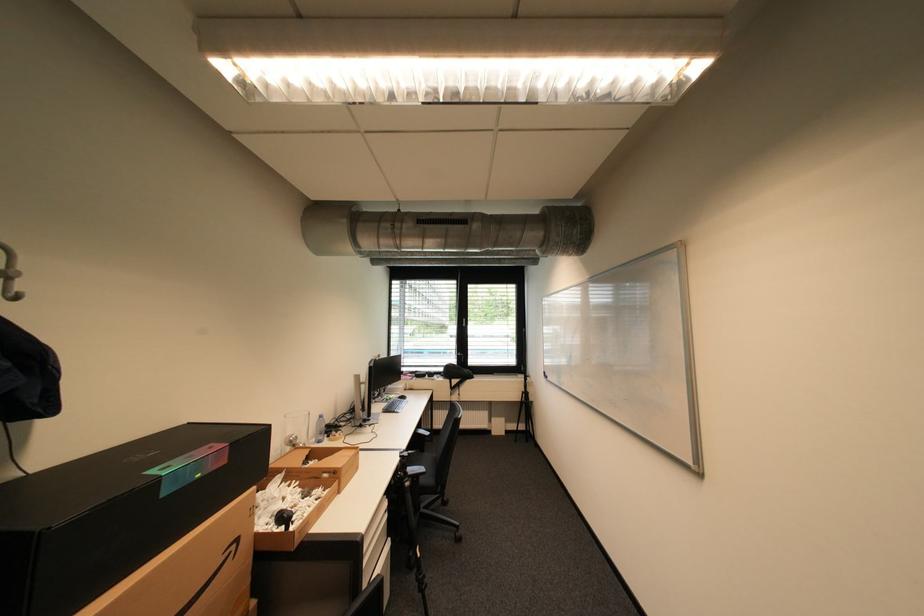
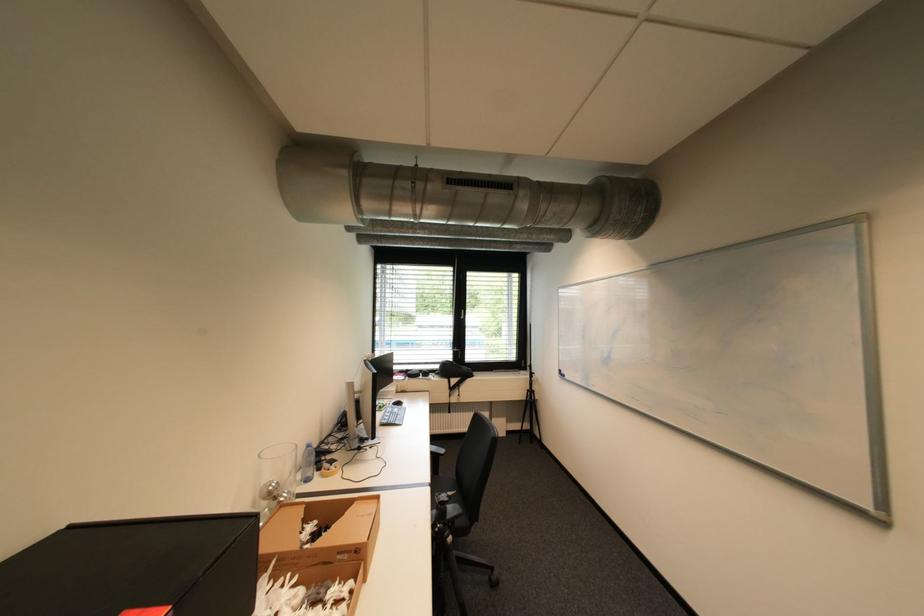
The point at (x=278, y=426) is marked in the first image. Where is the corresponding point in the second image?

(265, 516)